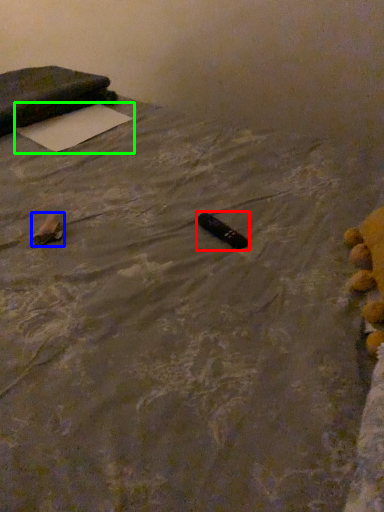
Question: Which object is positioned closest to waste (highlighted by a red box)? Select from waste (highlighted by a blue box) and yoga mat (highlighted by a green box).

Choices:
 (A) waste
 (B) yoga mat

Answer: (A)